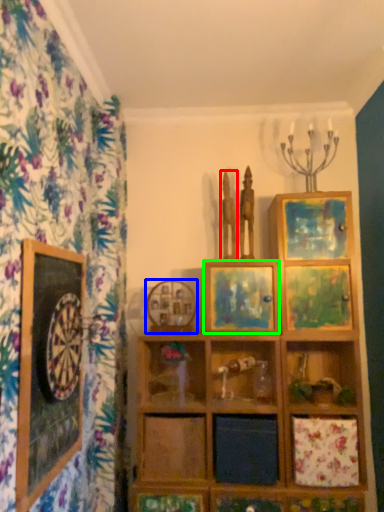
Question: Based on their relative distances, which object is nearer to sculpture (highlighted by a red box)? Choose from picture frame (highlighted by a blue box) and picture frame (highlighted by a green box).

Choices:
 (A) picture frame
 (B) picture frame

Answer: (B)